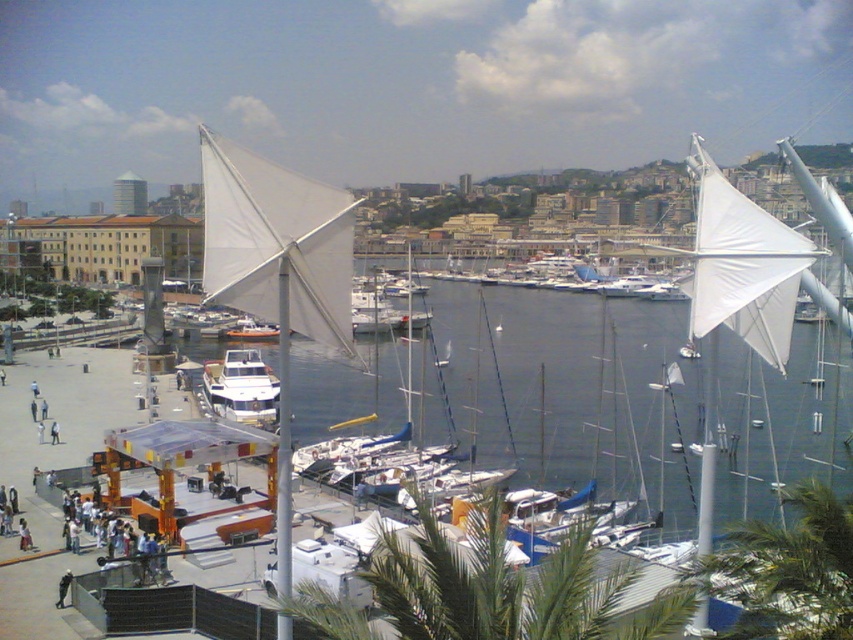
Question: From the image, what is the correct spatial relationship of green leafy palm tree at lower right in relation to white fabric sail at upper right?

Choices:
 (A) left
 (B) right

Answer: (A)

Question: Which object is farther from the camera taking this photo?

Choices:
 (A) transparent water at center
 (B) green leafy palm tree at lower center
 (C) white glossy sailboat at center

Answer: (A)

Question: Which point is farther from the camera taking this photo?

Choices:
 (A) (57, 593)
 (B) (750, 540)
 (C) (274, 332)

Answer: (C)

Question: Which of these objects is positioned farthest from the white fabric sail at upper right?

Choices:
 (A) transparent water at center
 (B) white glossy sailboat at center

Answer: (A)

Question: Does transparent water at center have a greater width compared to white glossy sailboat at center?

Choices:
 (A) yes
 (B) no

Answer: (A)

Question: Does white fabric sail at upper right have a lesser width compared to dark gray fabric jacket at lower left?

Choices:
 (A) no
 (B) yes

Answer: (A)